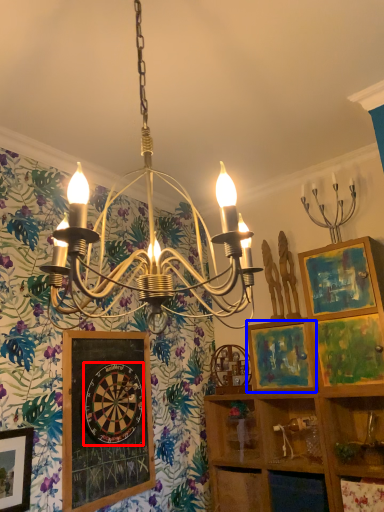
Question: Among these objects, which one is nearest to the camera, design (highlighted by a red box) or picture frame (highlighted by a blue box)?

Choices:
 (A) design
 (B) picture frame

Answer: (A)